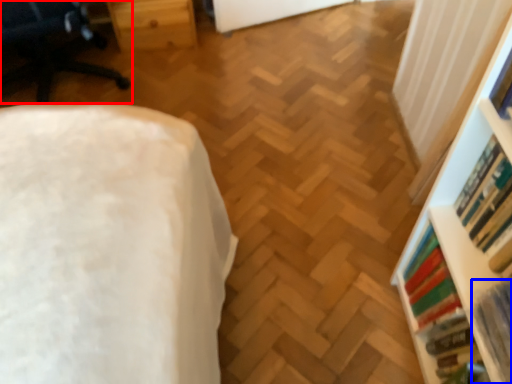
Question: Among these objects, which one is farthest to the camera, furniture (highlighted by a red box) or book (highlighted by a blue box)?

Choices:
 (A) furniture
 (B) book

Answer: (A)